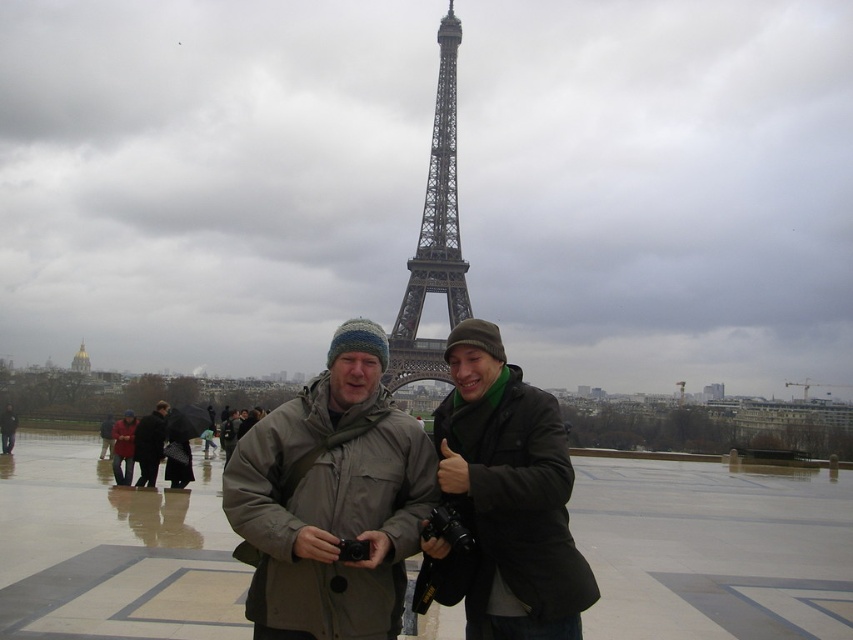
Can you confirm if knit cap at center is positioned below dark green matte jacket at center?

Yes.

Who is more forward, [224,474] or [469,604]?

Positioned in front is point [469,604].

Locate an element on the screen. The image size is (853, 640). knit cap at center is located at coordinates (331, 499).

Locate an element on the screen. Image resolution: width=853 pixels, height=640 pixels. knit cap at center is located at coordinates (331, 499).

Can you confirm if knit cap at center is thinner than dark gray knit hat at center?

No, knit cap at center is not thinner than dark gray knit hat at center.

Which is in front, point (305, 499) or point (148, 419)?

Point (305, 499) is more forward.

Locate an element on the screen. The image size is (853, 640). knit cap at center is located at coordinates (331, 499).

Who is taller, knit cap at center or dark brown leather coat at lower left?

With more height is knit cap at center.

Does point (314, 518) come farther from viewer compared to point (154, 406)?

No.

Which is in front, point (404, 502) or point (115, 445)?

Positioned in front is point (404, 502).

Locate an element on the screen. knit cap at center is located at coordinates (331, 499).